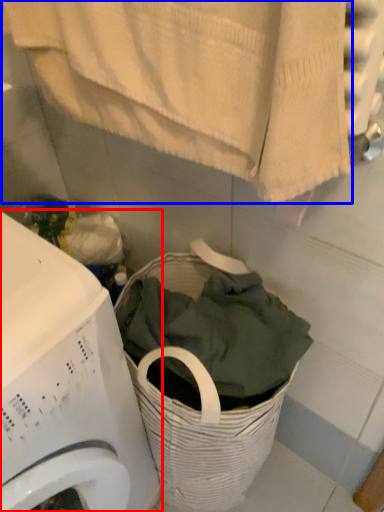
Question: Which object appears closest to the camera in this image, washing machine (highlighted by a red box) or bath towel (highlighted by a blue box)?

Choices:
 (A) washing machine
 (B) bath towel

Answer: (B)